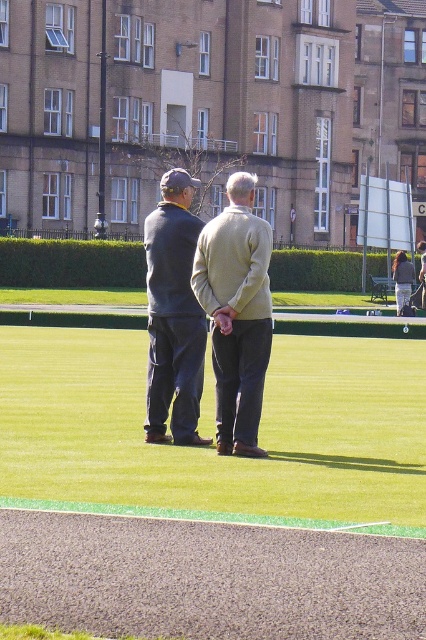
Is light beige sweater at center shorter than dark blue sweater at center?

Indeed, light beige sweater at center has a lesser height compared to dark blue sweater at center.

Can you confirm if light beige sweater at center is smaller than dark blue sweater at center?

Yes.

I want to click on light beige sweater at center, so click(236, 314).

I want to click on light beige sweater at center, so click(x=236, y=314).

Does point (359, 424) come behind point (250, 282)?

Yes.

Is green grass at center shorter than light beige sweater at center?

Yes.

Is point (302, 378) positioned after point (259, 236)?

Yes, it is behind point (259, 236).

Locate an element on the screen. green grass at center is located at coordinates (213, 445).

Is green grass at center shorter than dark blue sweater at center?

Yes.

Between green grass at center and dark blue sweater at center, which one is positioned higher?

Positioned higher is dark blue sweater at center.

Locate an element on the screen. The height and width of the screenshot is (640, 426). green grass at center is located at coordinates (213, 445).

At what (x,y) coordinates should I click in order to perform the action: click on green grass at center. Please return your answer as a coordinate pair (x, y). This screenshot has height=640, width=426. Looking at the image, I should click on (213, 445).